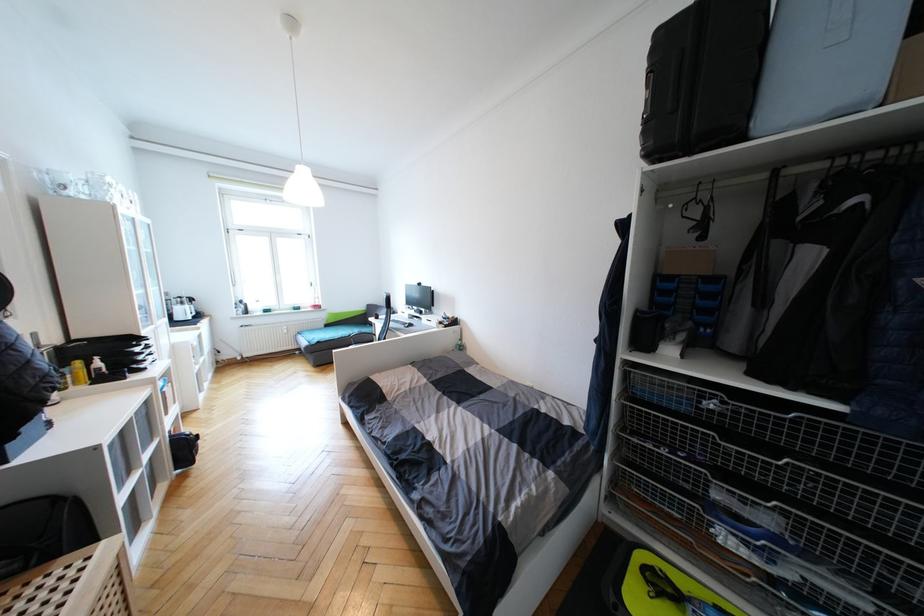
This screenshot has height=616, width=924. What do you see at coordinates (737, 488) in the screenshot?
I see `the wire basket handle` at bounding box center [737, 488].